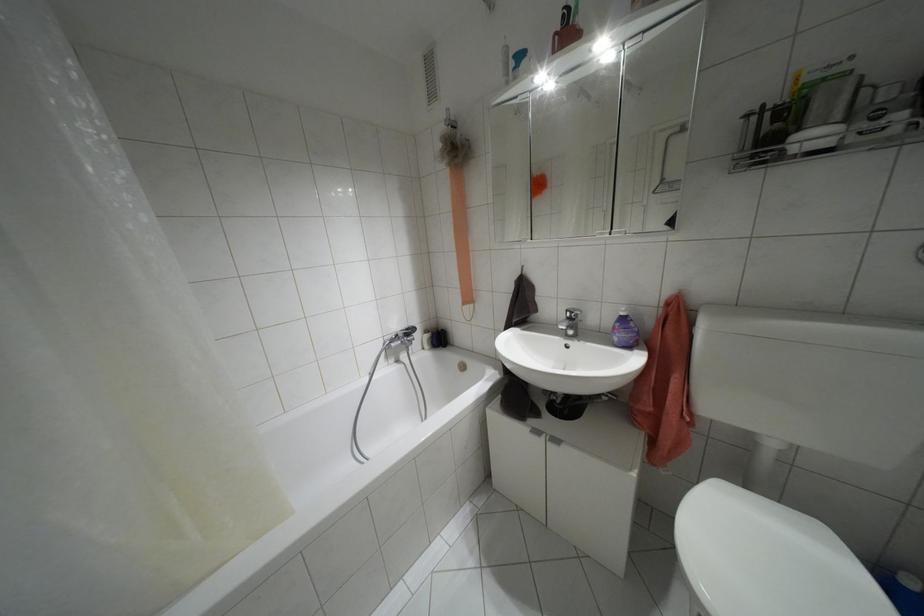
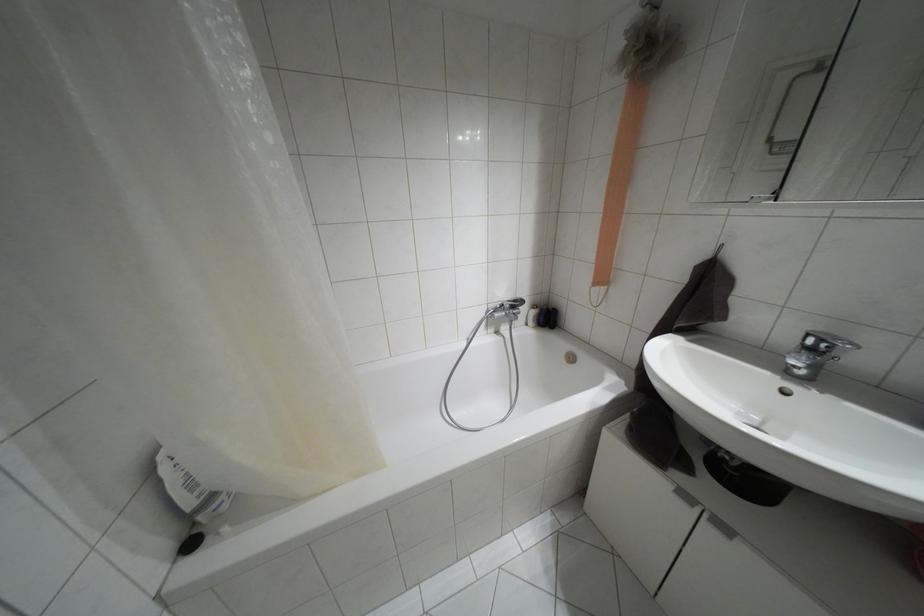
Where in the second image is the point corresponding to point 439,338 from the first image?

(546, 317)